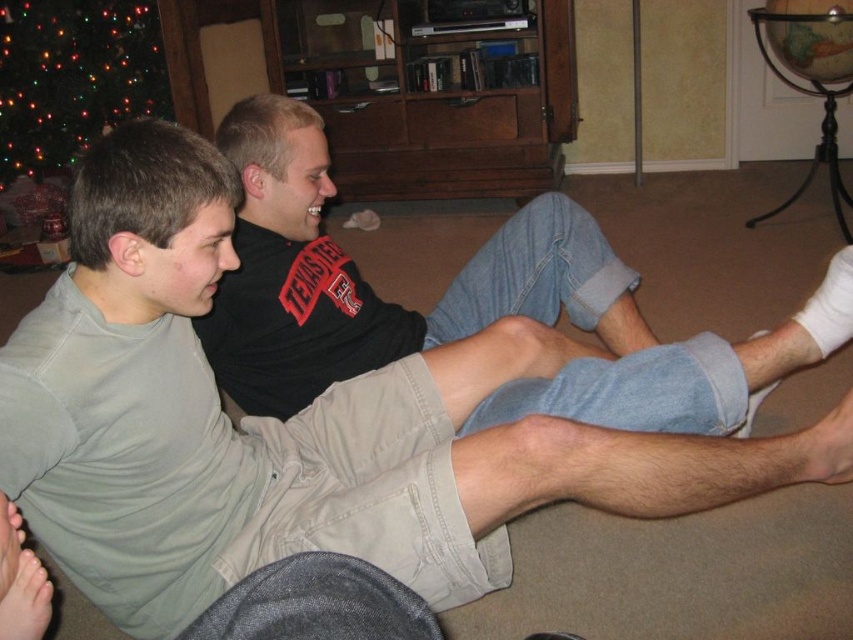
Question: Which object appears farthest from the camera in this image?

Choices:
 (A) light gray cotton pants at center
 (B) green glittering lights at upper left

Answer: (B)

Question: Does light gray cotton pants at center appear on the left side of green glittering lights at upper left?

Choices:
 (A) yes
 (B) no

Answer: (B)

Question: Is the position of light gray cotton pants at center more distant than that of green glittering lights at upper left?

Choices:
 (A) no
 (B) yes

Answer: (A)

Question: Can you confirm if light gray cotton pants at center is positioned to the left of green glittering lights at upper left?

Choices:
 (A) yes
 (B) no

Answer: (B)

Question: Which point appears farthest from the camera in this image?

Choices:
 (A) (297, 326)
 (B) (109, 92)

Answer: (B)